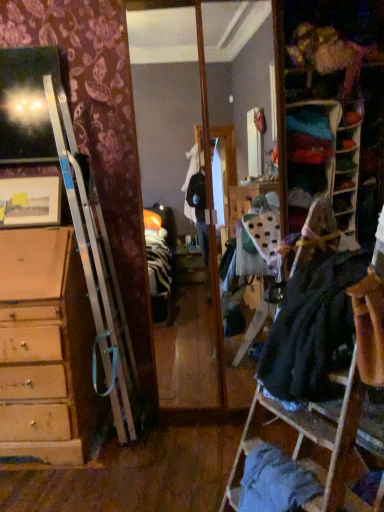
Question: Is the depth of matte wooden picture frame at upper left greater than that of velvet fabric bookshelf at upper right?

Choices:
 (A) no
 (B) yes

Answer: (A)

Question: Considering the relative positions of matte wooden picture frame at upper left and velvet fabric bookshelf at upper right in the image provided, is matte wooden picture frame at upper left to the left of velvet fabric bookshelf at upper right from the viewer's perspective?

Choices:
 (A) no
 (B) yes

Answer: (B)

Question: Can you confirm if matte wooden picture frame at upper left is smaller than velvet fabric bookshelf at upper right?

Choices:
 (A) yes
 (B) no

Answer: (B)

Question: Is matte wooden picture frame at upper left outside of velvet fabric bookshelf at upper right?

Choices:
 (A) no
 (B) yes

Answer: (B)

Question: From a real-world perspective, is matte wooden picture frame at upper left located beneath velvet fabric bookshelf at upper right?

Choices:
 (A) no
 (B) yes

Answer: (B)

Question: Is velvet fabric bookshelf at upper right in front of or behind dark gray fabric dress at right, acting as the first clothing starting from the top, in the image?

Choices:
 (A) behind
 (B) front

Answer: (A)

Question: In the image, is velvet fabric bookshelf at upper right on the left side or the right side of dark gray fabric dress at right, acting as the first clothing starting from the top?

Choices:
 (A) left
 (B) right

Answer: (B)

Question: From a real-world perspective, relative to dark gray fabric dress at right, positioned as the second clothing in bottom-to-top order, is velvet fabric bookshelf at upper right vertically above or below?

Choices:
 (A) below
 (B) above

Answer: (B)

Question: From their relative heights in the image, would you say velvet fabric bookshelf at upper right is taller or shorter than dark gray fabric dress at right, positioned as the second clothing in bottom-to-top order?

Choices:
 (A) tall
 (B) short

Answer: (A)

Question: Looking at their shapes, would you say blue cotton shirt at lower right, marked as the second clothing in a top-to-bottom arrangement, is wider or thinner than velvet fabric bookshelf at upper right?

Choices:
 (A) thin
 (B) wide

Answer: (B)

Question: In terms of height, does blue cotton shirt at lower right, the first clothing from the bottom, look taller or shorter compared to velvet fabric bookshelf at upper right?

Choices:
 (A) tall
 (B) short

Answer: (B)

Question: Is blue cotton shirt at lower right, marked as the second clothing in a top-to-bottom arrangement, in front of or behind velvet fabric bookshelf at upper right in the image?

Choices:
 (A) behind
 (B) front

Answer: (B)

Question: From a real-world perspective, is blue cotton shirt at lower right, the first clothing from the bottom, positioned above or below velvet fabric bookshelf at upper right?

Choices:
 (A) above
 (B) below

Answer: (B)

Question: From the image's perspective, is velvet fabric bookshelf at upper right located above or below matte wooden picture frame at upper left?

Choices:
 (A) below
 (B) above

Answer: (B)

Question: Considering the positions of velvet fabric bookshelf at upper right and matte wooden picture frame at upper left in the image, is velvet fabric bookshelf at upper right bigger or smaller than matte wooden picture frame at upper left?

Choices:
 (A) small
 (B) big

Answer: (A)